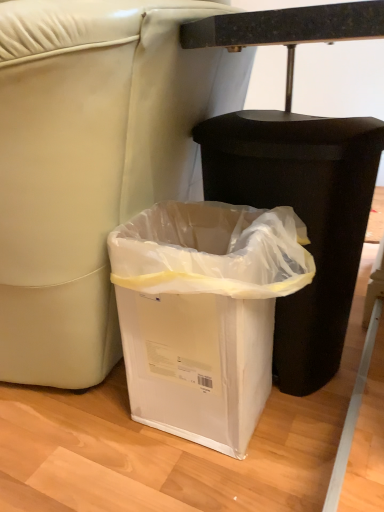
What do you see at coordinates (302, 217) in the screenshot? The width and height of the screenshot is (384, 512). I see `black plastic waste container at lower center, which appears as the 2th waste container when viewed from the left` at bounding box center [302, 217].

At what (x,y) coordinates should I click in order to perform the action: click on black plastic waste container at lower center, which ranks as the first waste container in right-to-left order. Please return your answer as a coordinate pair (x, y). Image resolution: width=384 pixels, height=512 pixels. Looking at the image, I should click on (302, 217).

In order to face white plastic waste container at lower center, which ranks as the second waste container in right-to-left order, should I rotate leftwards or rightwards?

You should look right and rotate roughly 3.326 degrees.

This screenshot has width=384, height=512. Describe the element at coordinates (204, 313) in the screenshot. I see `white plastic waste container at lower center, which ranks as the second waste container in right-to-left order` at that location.

Identify the location of white plastic waste container at lower center, positioned as the first waste container in left-to-right order. This screenshot has height=512, width=384. (204, 313).

Find the location of `black plastic waste container at lower center, which ranks as the first waste container in right-to-left order`. black plastic waste container at lower center, which ranks as the first waste container in right-to-left order is located at coordinates (302, 217).

Considering the positions of objects white plastic waste container at lower center, positioned as the first waste container in left-to-right order, and black plastic waste container at lower center, which ranks as the first waste container in right-to-left order, in the image provided, who is more to the right, white plastic waste container at lower center, positioned as the first waste container in left-to-right order, or black plastic waste container at lower center, which ranks as the first waste container in right-to-left order,?

black plastic waste container at lower center, which ranks as the first waste container in right-to-left order, is more to the right.

In the scene shown: Which object is more forward, white plastic waste container at lower center, positioned as the first waste container in left-to-right order, or black plastic waste container at lower center, which ranks as the first waste container in right-to-left order?

Positioned in front is white plastic waste container at lower center, positioned as the first waste container in left-to-right order.

Which is less distant, [187,296] or [218,189]?

The point [187,296] is more forward.

From the image's perspective, relative to black plastic waste container at lower center, which ranks as the first waste container in right-to-left order, is white plastic waste container at lower center, which ranks as the second waste container in right-to-left order, above or below?

Based on their image positions, white plastic waste container at lower center, which ranks as the second waste container in right-to-left order, is located beneath black plastic waste container at lower center, which ranks as the first waste container in right-to-left order.

From a real-world perspective, is white plastic waste container at lower center, which ranks as the second waste container in right-to-left order, located higher than black plastic waste container at lower center, which ranks as the first waste container in right-to-left order?

Actually, white plastic waste container at lower center, which ranks as the second waste container in right-to-left order, is physically below black plastic waste container at lower center, which ranks as the first waste container in right-to-left order, in the real world.

Looking at this image, is white plastic waste container at lower center, positioned as the first waste container in left-to-right order, wider than black plastic waste container at lower center, which ranks as the first waste container in right-to-left order?

In fact, white plastic waste container at lower center, positioned as the first waste container in left-to-right order, might be narrower than black plastic waste container at lower center, which ranks as the first waste container in right-to-left order.

From the picture: In terms of height, does white plastic waste container at lower center, positioned as the first waste container in left-to-right order, look taller or shorter compared to black plastic waste container at lower center, which appears as the 2th waste container when viewed from the left?

Considering their sizes, white plastic waste container at lower center, positioned as the first waste container in left-to-right order, has less height than black plastic waste container at lower center, which appears as the 2th waste container when viewed from the left.

Consider the image. Is white plastic waste container at lower center, which ranks as the second waste container in right-to-left order, bigger or smaller than black plastic waste container at lower center, which ranks as the first waste container in right-to-left order?

In the image, white plastic waste container at lower center, which ranks as the second waste container in right-to-left order, appears to be smaller than black plastic waste container at lower center, which ranks as the first waste container in right-to-left order.

Does white plastic waste container at lower center, which ranks as the second waste container in right-to-left order, contain black plastic waste container at lower center, which ranks as the first waste container in right-to-left order?

Definitely not — black plastic waste container at lower center, which ranks as the first waste container in right-to-left order, is not inside white plastic waste container at lower center, which ranks as the second waste container in right-to-left order.

Is white plastic waste container at lower center, which ranks as the second waste container in right-to-left order, placed right next to black plastic waste container at lower center, which appears as the 2th waste container when viewed from the left?

white plastic waste container at lower center, which ranks as the second waste container in right-to-left order, is not next to black plastic waste container at lower center, which appears as the 2th waste container when viewed from the left, and they're not touching.

Is white plastic waste container at lower center, which ranks as the second waste container in right-to-left order, oriented away from black plastic waste container at lower center, which appears as the 2th waste container when viewed from the left?

No, white plastic waste container at lower center, which ranks as the second waste container in right-to-left order, is not facing away from black plastic waste container at lower center, which appears as the 2th waste container when viewed from the left.

How different are the orientations of white plastic waste container at lower center, positioned as the first waste container in left-to-right order, and black plastic waste container at lower center, which appears as the 2th waste container when viewed from the left, in degrees?

There is a 0.000671-degree angle between the facing directions of white plastic waste container at lower center, positioned as the first waste container in left-to-right order, and black plastic waste container at lower center, which appears as the 2th waste container when viewed from the left.

Where is `waste container in front of the black plastic waste container at lower center, which ranks as the first waste container in right-to-left order`? Image resolution: width=384 pixels, height=512 pixels. waste container in front of the black plastic waste container at lower center, which ranks as the first waste container in right-to-left order is located at coordinates (204, 313).

Considering the positions of objects black plastic waste container at lower center, which appears as the 2th waste container when viewed from the left, and white plastic waste container at lower center, which ranks as the second waste container in right-to-left order, in the image provided, who is more to the right, black plastic waste container at lower center, which appears as the 2th waste container when viewed from the left, or white plastic waste container at lower center, which ranks as the second waste container in right-to-left order,?

black plastic waste container at lower center, which appears as the 2th waste container when viewed from the left.

Is black plastic waste container at lower center, which ranks as the first waste container in right-to-left order, in front of or behind white plastic waste container at lower center, which ranks as the second waste container in right-to-left order, in the image?

Visually, black plastic waste container at lower center, which ranks as the first waste container in right-to-left order, is located behind white plastic waste container at lower center, which ranks as the second waste container in right-to-left order.

Which point is more forward, (x=235, y=157) or (x=210, y=386)?

The point (x=210, y=386) is more forward.

From the image's perspective, which one is positioned lower, black plastic waste container at lower center, which ranks as the first waste container in right-to-left order, or white plastic waste container at lower center, positioned as the first waste container in left-to-right order?

white plastic waste container at lower center, positioned as the first waste container in left-to-right order, from the image's perspective.

From a real-world perspective, relative to white plastic waste container at lower center, positioned as the first waste container in left-to-right order, is black plastic waste container at lower center, which appears as the 2th waste container when viewed from the left, vertically above or below?

black plastic waste container at lower center, which appears as the 2th waste container when viewed from the left, is situated higher than white plastic waste container at lower center, positioned as the first waste container in left-to-right order, in the real world.

In terms of width, does black plastic waste container at lower center, which ranks as the first waste container in right-to-left order, look wider or thinner when compared to white plastic waste container at lower center, which ranks as the second waste container in right-to-left order?

black plastic waste container at lower center, which ranks as the first waste container in right-to-left order, is wider than white plastic waste container at lower center, which ranks as the second waste container in right-to-left order.

Considering the sizes of objects black plastic waste container at lower center, which ranks as the first waste container in right-to-left order, and white plastic waste container at lower center, positioned as the first waste container in left-to-right order, in the image provided, who is taller, black plastic waste container at lower center, which ranks as the first waste container in right-to-left order, or white plastic waste container at lower center, positioned as the first waste container in left-to-right order,?

Standing taller between the two is black plastic waste container at lower center, which ranks as the first waste container in right-to-left order.

In terms of size, does black plastic waste container at lower center, which ranks as the first waste container in right-to-left order, appear bigger or smaller than white plastic waste container at lower center, positioned as the first waste container in left-to-right order?

Clearly, black plastic waste container at lower center, which ranks as the first waste container in right-to-left order, is larger in size than white plastic waste container at lower center, positioned as the first waste container in left-to-right order.

Is black plastic waste container at lower center, which ranks as the first waste container in right-to-left order, situated inside white plastic waste container at lower center, which ranks as the second waste container in right-to-left order, or outside?

The correct answer is: outside.

Are black plastic waste container at lower center, which ranks as the first waste container in right-to-left order, and white plastic waste container at lower center, positioned as the first waste container in left-to-right order, located far from each other?

Actually, black plastic waste container at lower center, which ranks as the first waste container in right-to-left order, and white plastic waste container at lower center, positioned as the first waste container in left-to-right order, are a little close together.

Is black plastic waste container at lower center, which ranks as the first waste container in right-to-left order, turned away from white plastic waste container at lower center, which ranks as the second waste container in right-to-left order?

No, white plastic waste container at lower center, which ranks as the second waste container in right-to-left order, is not at the back of black plastic waste container at lower center, which ranks as the first waste container in right-to-left order.

How different are the orientations of black plastic waste container at lower center, which appears as the 2th waste container when viewed from the left, and white plastic waste container at lower center, which ranks as the second waste container in right-to-left order, in degrees?

0.000671 degrees.

How far apart are black plastic waste container at lower center, which appears as the 2th waste container when viewed from the left, and white plastic waste container at lower center, which ranks as the second waste container in right-to-left order?

black plastic waste container at lower center, which appears as the 2th waste container when viewed from the left, and white plastic waste container at lower center, which ranks as the second waste container in right-to-left order, are 6.98 inches apart.

At what (x,y) coordinates should I click in order to perform the action: click on waste container to the left of black plastic waste container at lower center, which appears as the 2th waste container when viewed from the left. Please return your answer as a coordinate pair (x, y). Looking at the image, I should click on (204, 313).

You are a GUI agent. You are given a task and a screenshot of the screen. Output one action in this format:
    pyautogui.click(x=<x>, y=<y>)
    Task: Click on the waste container below the black plastic waste container at lower center, which appears as the 2th waste container when viewed from the left (from a real-world perspective)
    The image size is (384, 512).
    Given the screenshot: What is the action you would take?
    pyautogui.click(x=204, y=313)

Locate an element on the screen. The image size is (384, 512). waste container behind the white plastic waste container at lower center, positioned as the first waste container in left-to-right order is located at coordinates (302, 217).